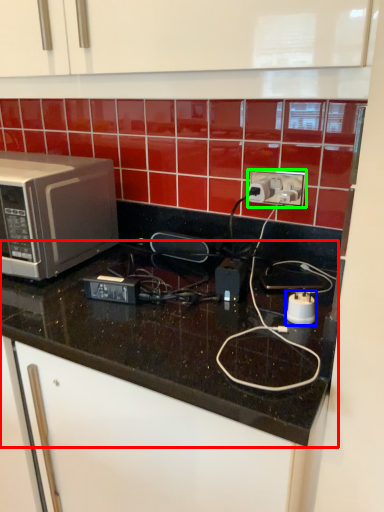
Question: Based on their relative distances, which object is nearer to countertop (highlighted by a red box)? Choose from appliance (highlighted by a blue box) and power plugs and sockets (highlighted by a green box).

Choices:
 (A) appliance
 (B) power plugs and sockets

Answer: (A)